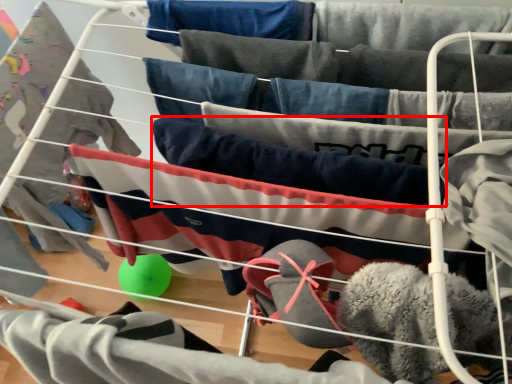
Question: From the image's perspective, where is clothing (annotated by the red box) located relative to clothing?

Choices:
 (A) below
 (B) above

Answer: (B)